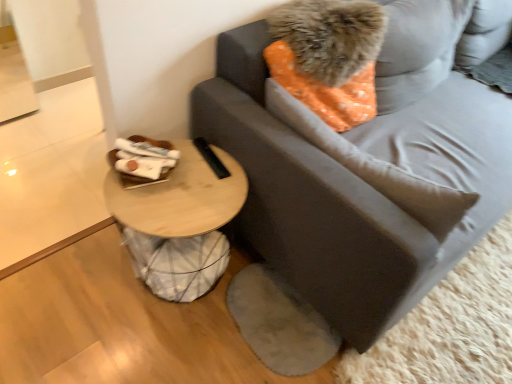
Question: From the image's perspective, is woodenmaterial/texturetable at lower left located above or below gray fabric pillow at upper right, the 1th pillow when ordered from bottom to top?

Choices:
 (A) below
 (B) above

Answer: (A)

Question: Is woodenmaterial/texturetable at lower left to the left or to the right of gray fabric pillow at upper right, the 1th pillow when ordered from bottom to top, in the image?

Choices:
 (A) right
 (B) left

Answer: (B)

Question: Which object is the farthest from the orange dotted fabric pillow at upper right, the first pillow positioned from the top?

Choices:
 (A) gray fabric pillow at upper right, the 1th pillow when ordered from bottom to top
 (B) gray fabric studio couch at center
 (C) woodenmaterial/texturetable at lower left

Answer: (C)

Question: Which object is the closest to the gray fabric studio couch at center?

Choices:
 (A) woodenmaterial/texturetable at lower left
 (B) orange dotted fabric pillow at upper right, which is counted as the 2th pillow, starting from the bottom
 (C) gray fabric pillow at upper right, the 1th pillow when ordered from bottom to top

Answer: (B)